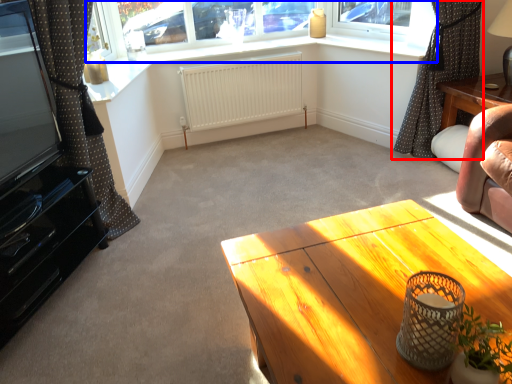
Question: Which point is further to the camera, curtain (highlighted by a red box) or window (highlighted by a blue box)?

Choices:
 (A) curtain
 (B) window

Answer: (B)